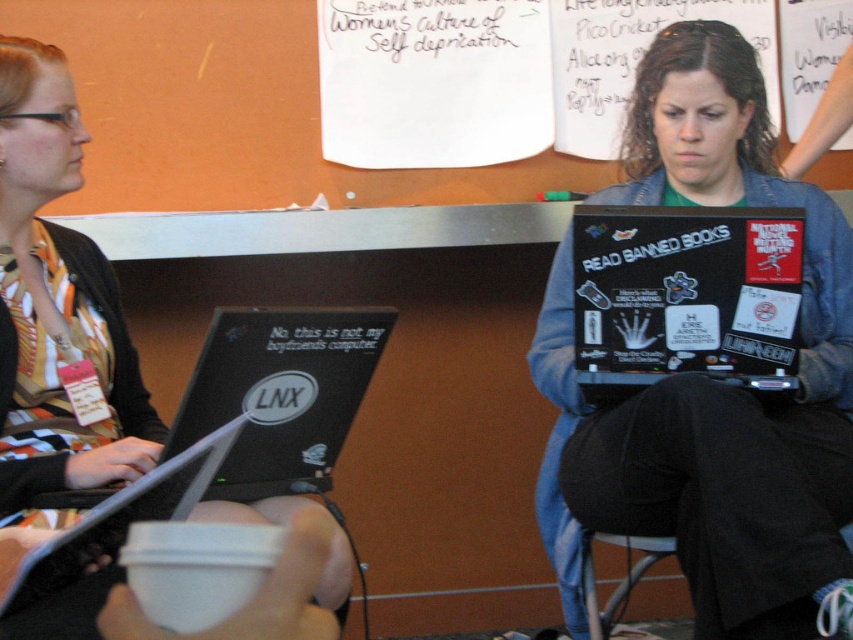
Question: Is black glossy laptop at center thinner than striped fabric shirt at left?

Choices:
 (A) no
 (B) yes

Answer: (A)

Question: Which point is farther from the camera taking this photo?

Choices:
 (A) (653, 544)
 (B) (126, 12)
 (C) (239, 506)

Answer: (B)

Question: Based on their relative distances, which object is farther from the striped fabric shirt at left?

Choices:
 (A) metallic gray chair at lower center
 (B) white paper at upper center
 (C) black matte laptop at lower left
 (D) black matte laptop at center

Answer: (B)

Question: Does striped fabric shirt at left have a greater width compared to black matte laptop at lower left?

Choices:
 (A) yes
 (B) no

Answer: (A)

Question: Which of the following is the farthest from the observer?

Choices:
 (A) striped fabric shirt at left
 (B) black matte laptop at center

Answer: (B)

Question: Is black matte laptop at lower left smaller than metallic gray chair at lower center?

Choices:
 (A) yes
 (B) no

Answer: (B)